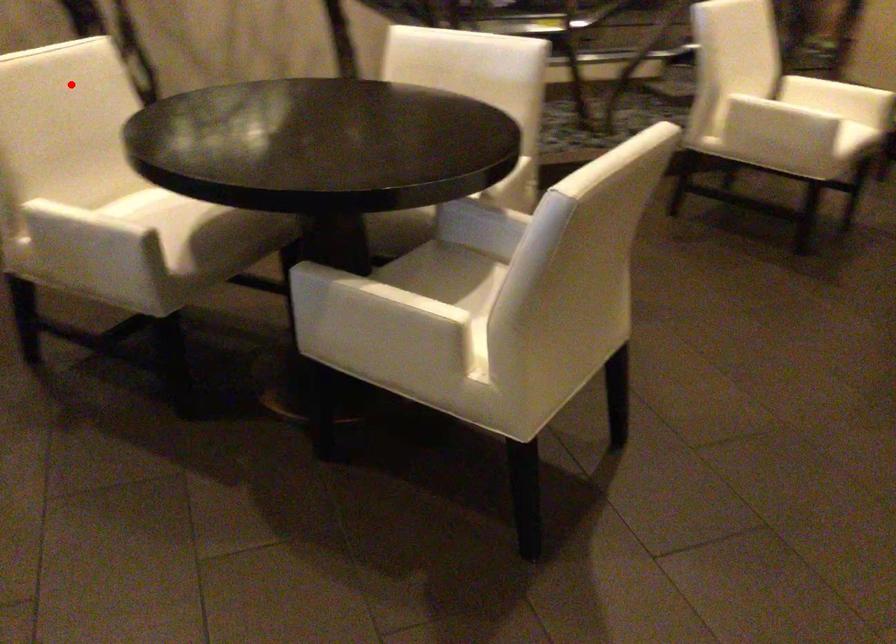
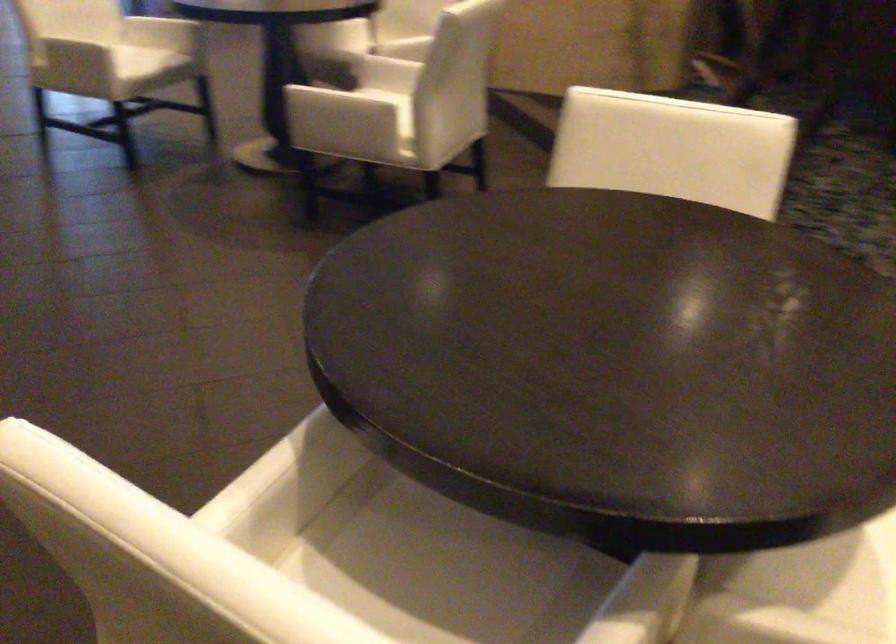
Question: I am providing you with two images of the same scene from different viewpoints. A red point is shown in image1. For the corresponding object point in image2, is it positioned nearer or farther from the camera?

Choices:
 (A) Nearer
 (B) Farther

Answer: (A)